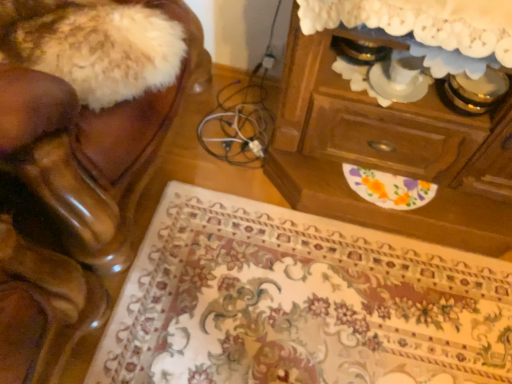
Question: Can you confirm if wooden chest of drawers at upper right is bigger than shiny brown leather chair at left?

Choices:
 (A) yes
 (B) no

Answer: (B)

Question: From a real-world perspective, is wooden chest of drawers at upper right located beneath shiny brown leather chair at left?

Choices:
 (A) yes
 (B) no

Answer: (A)

Question: Considering the relative positions of wooden chest of drawers at upper right and shiny brown leather chair at left in the image provided, is wooden chest of drawers at upper right to the right of shiny brown leather chair at left from the viewer's perspective?

Choices:
 (A) no
 (B) yes

Answer: (B)

Question: Is there a large distance between wooden chest of drawers at upper right and shiny brown leather chair at left?

Choices:
 (A) no
 (B) yes

Answer: (A)

Question: Does wooden chest of drawers at upper right have a greater height compared to shiny brown leather chair at left?

Choices:
 (A) no
 (B) yes

Answer: (A)

Question: Based on their sizes in the image, would you say wooden chest of drawers at upper right is bigger or smaller than floral carpet at lower center?

Choices:
 (A) big
 (B) small

Answer: (A)

Question: Considering the relative positions of wooden chest of drawers at upper right and floral carpet at lower center in the image provided, is wooden chest of drawers at upper right to the left or to the right of floral carpet at lower center?

Choices:
 (A) left
 (B) right

Answer: (B)

Question: Is wooden chest of drawers at upper right wider or thinner than floral carpet at lower center?

Choices:
 (A) thin
 (B) wide

Answer: (A)

Question: From their relative heights in the image, would you say wooden chest of drawers at upper right is taller or shorter than floral carpet at lower center?

Choices:
 (A) short
 (B) tall

Answer: (B)

Question: In the image, is shiny brown leather chair at left on the left side or the right side of wooden chest of drawers at upper right?

Choices:
 (A) right
 (B) left

Answer: (B)

Question: Considering the positions of shiny brown leather chair at left and wooden chest of drawers at upper right in the image, is shiny brown leather chair at left taller or shorter than wooden chest of drawers at upper right?

Choices:
 (A) tall
 (B) short

Answer: (A)

Question: From the image's perspective, relative to wooden chest of drawers at upper right, is shiny brown leather chair at left above or below?

Choices:
 (A) above
 (B) below

Answer: (A)

Question: Is point (186, 34) closer or farther from the camera than point (476, 208)?

Choices:
 (A) closer
 (B) farther

Answer: (B)

Question: Relative to wooden chest of drawers at upper right, is floral carpet at lower center in front or behind?

Choices:
 (A) front
 (B) behind

Answer: (B)

Question: Is floral carpet at lower center bigger or smaller than wooden chest of drawers at upper right?

Choices:
 (A) small
 (B) big

Answer: (A)